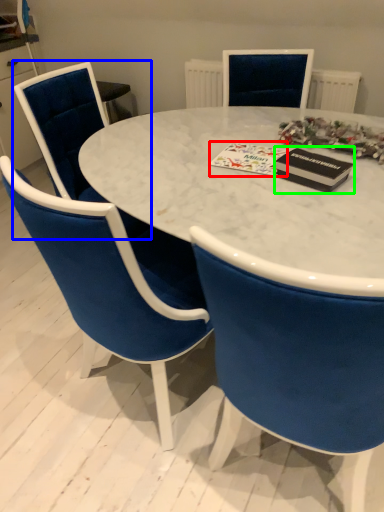
Question: Which object is positioned farthest from christmas card (highlighted by a red box)? Select from chair (highlighted by a blue box) and magazine (highlighted by a green box).

Choices:
 (A) chair
 (B) magazine

Answer: (A)